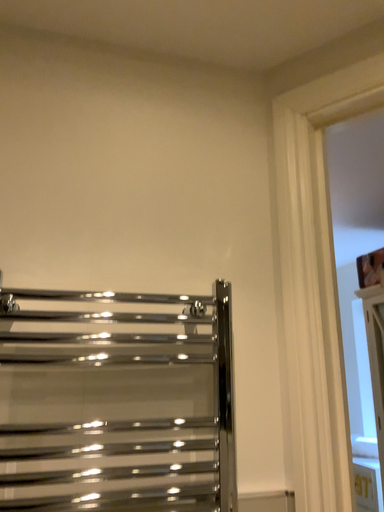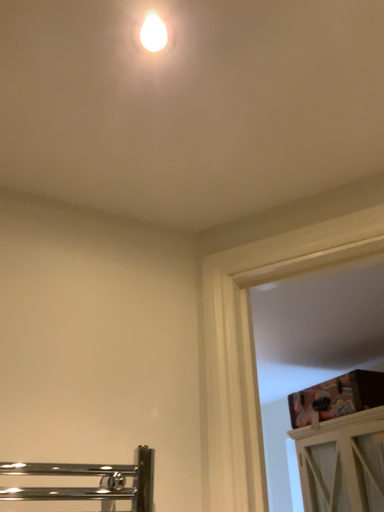
Question: How did the camera likely rotate when shooting the video?

Choices:
 (A) rotated downward
 (B) rotated upward

Answer: (B)